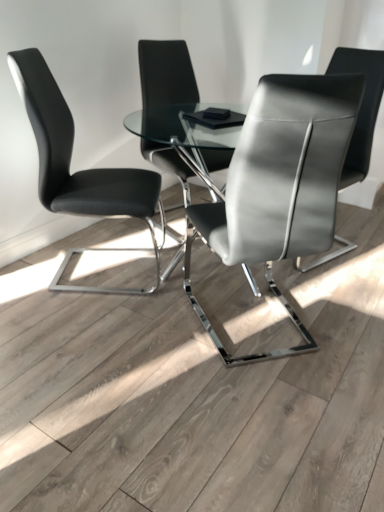
Question: Can you confirm if satin gray leather chair at center, marked as the second chair in a right-to-left arrangement, is positioned to the right of matte black chair at center, the second chair positioned from the left?

Choices:
 (A) yes
 (B) no

Answer: (A)

Question: From the image's perspective, would you say satin gray leather chair at center, marked as the second chair in a right-to-left arrangement, is positioned over matte black chair at center, the second chair positioned from the left?

Choices:
 (A) yes
 (B) no

Answer: (B)

Question: Can you confirm if satin gray leather chair at center, marked as the second chair in a right-to-left arrangement, is wider than matte black chair at center, the second chair positioned from the left?

Choices:
 (A) yes
 (B) no

Answer: (A)

Question: From a real-world perspective, is satin gray leather chair at center, placed as the 3th chair when sorted from left to right, on top of matte black chair at center, arranged as the third chair when viewed from the right?

Choices:
 (A) no
 (B) yes

Answer: (A)

Question: Does satin gray leather chair at center, placed as the 3th chair when sorted from left to right, have a greater height compared to matte black chair at center, the second chair positioned from the left?

Choices:
 (A) yes
 (B) no

Answer: (B)

Question: Considering the positions of black leather chair at left, which is counted as the 1th chair, starting from the left, and satin gray leather chair at center, marked as the second chair in a right-to-left arrangement, in the image, is black leather chair at left, which is counted as the 1th chair, starting from the left, bigger or smaller than satin gray leather chair at center, marked as the second chair in a right-to-left arrangement,?

Choices:
 (A) small
 (B) big

Answer: (A)

Question: Is black leather chair at left, which appears as the fourth chair when viewed from the right, inside the boundaries of satin gray leather chair at center, placed as the 3th chair when sorted from left to right, or outside?

Choices:
 (A) inside
 (B) outside

Answer: (B)

Question: Based on their positions, is black leather chair at left, which is counted as the 1th chair, starting from the left, located to the left or right of satin gray leather chair at center, marked as the second chair in a right-to-left arrangement?

Choices:
 (A) left
 (B) right

Answer: (A)

Question: From a real-world perspective, is black leather chair at left, which appears as the fourth chair when viewed from the right, physically located above or below satin gray leather chair at center, marked as the second chair in a right-to-left arrangement?

Choices:
 (A) below
 (B) above

Answer: (A)

Question: Is satin black chair at center, positioned as the 1th chair in right-to-left order, taller or shorter than black leather chair at left, which is counted as the 1th chair, starting from the left?

Choices:
 (A) short
 (B) tall

Answer: (B)

Question: In the image, is satin black chair at center, the 4th chair positioned from the left, positioned in front of or behind black leather chair at left, which appears as the fourth chair when viewed from the right?

Choices:
 (A) behind
 (B) front

Answer: (A)

Question: From a real-world perspective, is satin black chair at center, positioned as the 1th chair in right-to-left order, positioned above or below black leather chair at left, which appears as the fourth chair when viewed from the right?

Choices:
 (A) below
 (B) above

Answer: (A)

Question: Considering the positions of satin black chair at center, the 4th chair positioned from the left, and black leather chair at left, which appears as the fourth chair when viewed from the right, in the image, is satin black chair at center, the 4th chair positioned from the left, bigger or smaller than black leather chair at left, which appears as the fourth chair when viewed from the right,?

Choices:
 (A) big
 (B) small

Answer: (A)

Question: Is black leather chair at left, which appears as the fourth chair when viewed from the right, taller or shorter than satin black chair at center, the 4th chair positioned from the left?

Choices:
 (A) tall
 (B) short

Answer: (B)

Question: Is point (145, 220) closer or farther from the camera than point (344, 51)?

Choices:
 (A) closer
 (B) farther

Answer: (B)